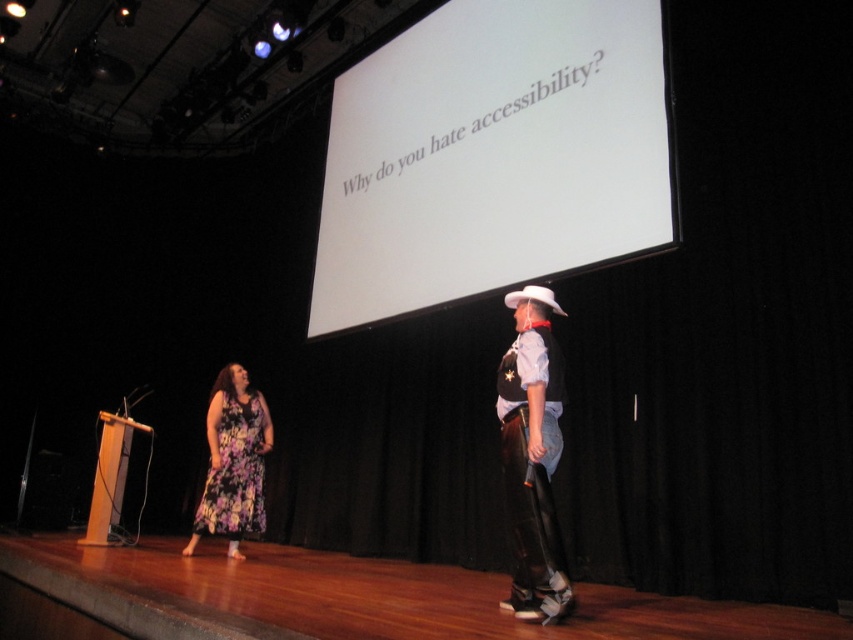
You are a stagehand setting up a spotlight for the presenter at the podium. The spotlight can only illuminate objects within a radius of 0.5 units from its position at point A. If you place the spotlight at point B, which is 0.3 units to the right and 0.4 units below point A, will the white matte projection screen at upper center be illuminated?

The white matte projection screen at upper center is located at point (492, 156). The spotlight is placed at point B, which is 0.3 units right and 0.4 units below point A. The distance between point B and the screen must be calculated. However, without knowing point A or B coordinates, we can infer that the spotlight has a radius of 0.5 units. Since the screen is at (492, 156), if point B is within 0.5 units from it, it would be lit. But without exact coordinates for B relative to the screen, we cannot.

You are an audience member sitting in the front row of the stage. You notice the white matte projection screen at upper center and the floral fabric dress at lower left. Which object is positioned closer to you?

The white matte projection screen at upper center is closer to the viewer than the floral fabric dress at lower left.

From the picture: You are an event organizer planning to place a 3D model of the leather cowboy boots at right on the stage. The model must be placed such that it does not exceed the width of the white matte projection screen at upper center. Can you position it appropriately?

The white matte projection screen at upper center is wider than the leather cowboy boots at right, so yes, you can position the 3D model of the leather cowboy boots at right without exceeding the screen width.